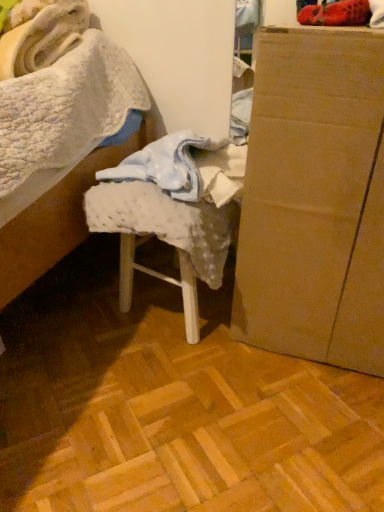
Question: Is white textured fabric at center in front of cardboard box at right?

Choices:
 (A) yes
 (B) no

Answer: (B)

Question: From the image's perspective, is white textured fabric at center below cardboard box at right?

Choices:
 (A) yes
 (B) no

Answer: (A)

Question: Does white textured fabric at center have a greater height compared to cardboard box at right?

Choices:
 (A) no
 (B) yes

Answer: (A)

Question: Is the depth of white textured fabric at center greater than that of cardboard box at right?

Choices:
 (A) no
 (B) yes

Answer: (B)

Question: Can you confirm if white textured fabric at center is smaller than cardboard box at right?

Choices:
 (A) yes
 (B) no

Answer: (A)

Question: Is white textured fabric at center to the left of cardboard box at right from the viewer's perspective?

Choices:
 (A) yes
 (B) no

Answer: (A)

Question: Considering the relative sizes of cardboard box at right and white textured fabric at center in the image provided, is cardboard box at right taller than white textured fabric at center?

Choices:
 (A) yes
 (B) no

Answer: (A)

Question: Does cardboard box at right have a lesser height compared to white textured fabric at center?

Choices:
 (A) no
 (B) yes

Answer: (A)

Question: Is cardboard box at right positioned in front of white textured fabric at center?

Choices:
 (A) yes
 (B) no

Answer: (A)

Question: Is cardboard box at right facing away from white textured fabric at center?

Choices:
 (A) no
 (B) yes

Answer: (A)

Question: From a real-world perspective, is cardboard box at right positioned over white textured fabric at center based on gravity?

Choices:
 (A) no
 (B) yes

Answer: (B)

Question: Is cardboard box at right thinner than white textured fabric at center?

Choices:
 (A) yes
 (B) no

Answer: (B)

Question: From the image's perspective, is cardboard box at right positioned above or below white textured fabric at center?

Choices:
 (A) below
 (B) above

Answer: (B)